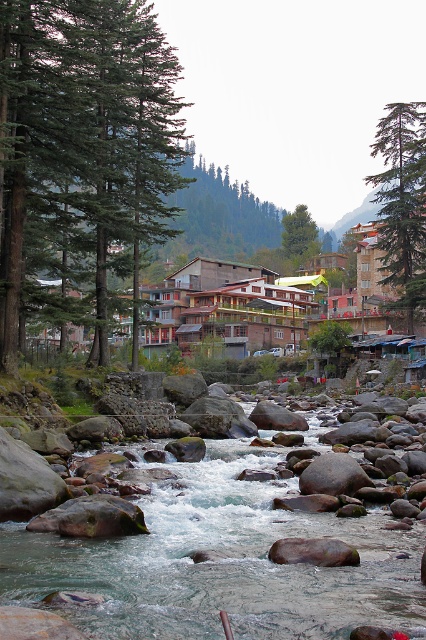
You are standing at the origin point of the image. Which direction should you walk to reach the green evergreen trees at left?

You should walk towards the left direction to reach the green evergreen trees at left since they are located at point [81,152] which is to the left of the origin point.

You are a hiker planning to cross the smooth rock river at center from the green matte tree at upper right. Given that the river is 215.01 feet away from the tree, is this distance within a safe range for a typical hiking path? Please explain your reasoning.

The smooth rock river at center is 215.01 feet from the green matte tree at upper right. This distance is within a safe range for a typical hiking path as most hiking paths are designed to accommodate distances up to 250 feet between landmarks without requiring special equipment.